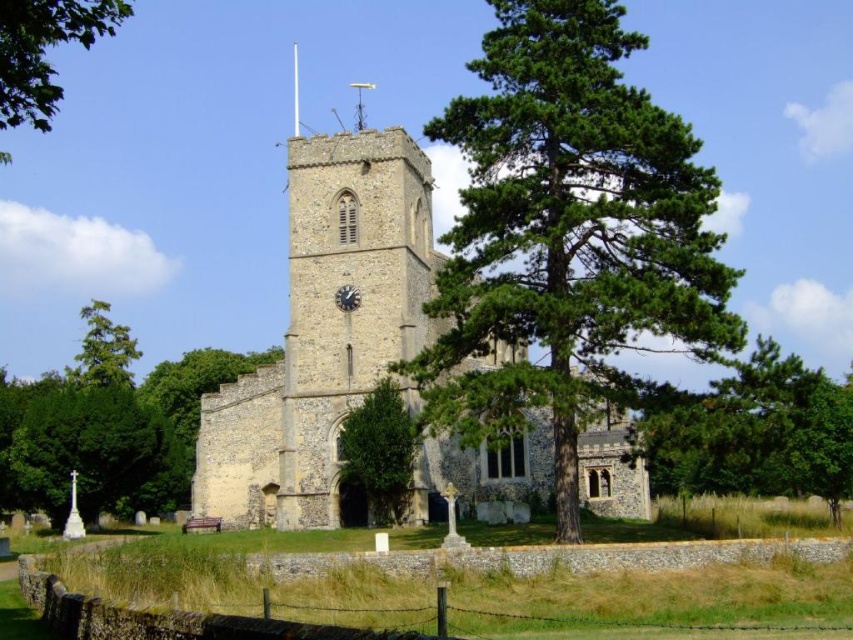
You are standing in front of the historic stone church and want to take a photo of both the green textured pine tree at center and the metallic clock face at center. Can you frame both objects in the same shot without moving your position?

The green textured pine tree at center is located above the metallic clock face at center, so you can frame both in the same shot by adjusting your camera angle to include the area above and below the center of the image.

You are standing at the center of the grassy area in front of the historic stone church. You want to place a new bench exactly at the point where the green textured pine tree at center is located. Is this possible?

The green textured pine tree at center is located at point (567, 236), so placing a bench there would not be possible as the tree is already occupying that spot.